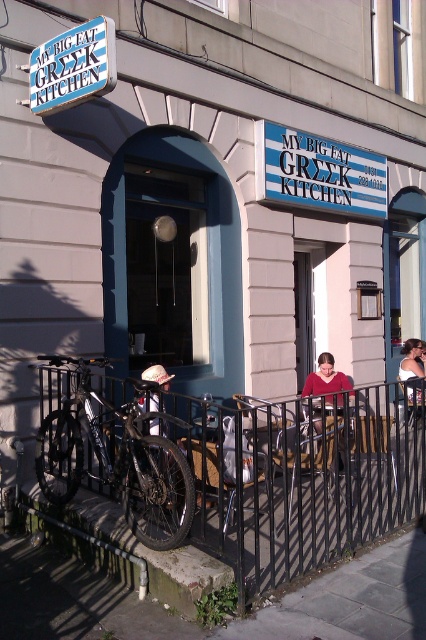
Who is positioned more to the right, concrete pavement at lower center or white matte baseball cap at center?

concrete pavement at lower center

Which is in front, point (402, 552) or point (158, 403)?

Point (402, 552) is more forward.

Which is in front, point (296, 598) or point (138, 401)?

Positioned in front is point (296, 598).

Find the location of `concrete pavement at lower center`. concrete pavement at lower center is located at coordinates (216, 627).

Between silver metallic bicycle at lower left and matte red sweater at center, which one has less height?

matte red sweater at center

Does silver metallic bicycle at lower left appear on the right side of matte red sweater at center?

No, silver metallic bicycle at lower left is not to the right of matte red sweater at center.

Is point (80, 442) in front of point (328, 378)?

Yes, it is.

Identify the location of silver metallic bicycle at lower left. (117, 458).

Between point (337, 440) and point (152, 380), which one is positioned behind?

The point (337, 440) is more distant.

Does black metal fence at lower center appear under white matte baseball cap at center?

Yes.

Does point (299, 465) come behind point (152, 401)?

Yes, point (299, 465) is farther from viewer.

Where is `black metal fence at lower center`? This screenshot has width=426, height=640. black metal fence at lower center is located at coordinates (302, 476).